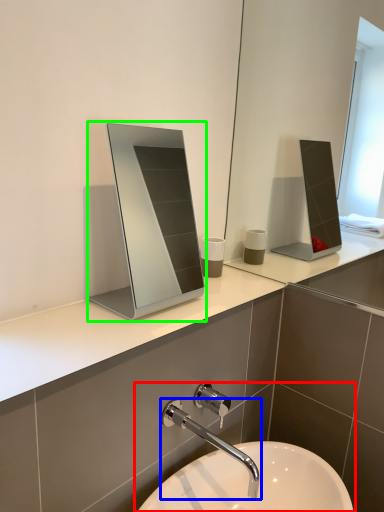
Question: Considering the real-world distances, which object is farthest from sink (highlighted by a red box)? tap (highlighted by a blue box) or medicine cabinet (highlighted by a green box)?

Choices:
 (A) tap
 (B) medicine cabinet

Answer: (B)